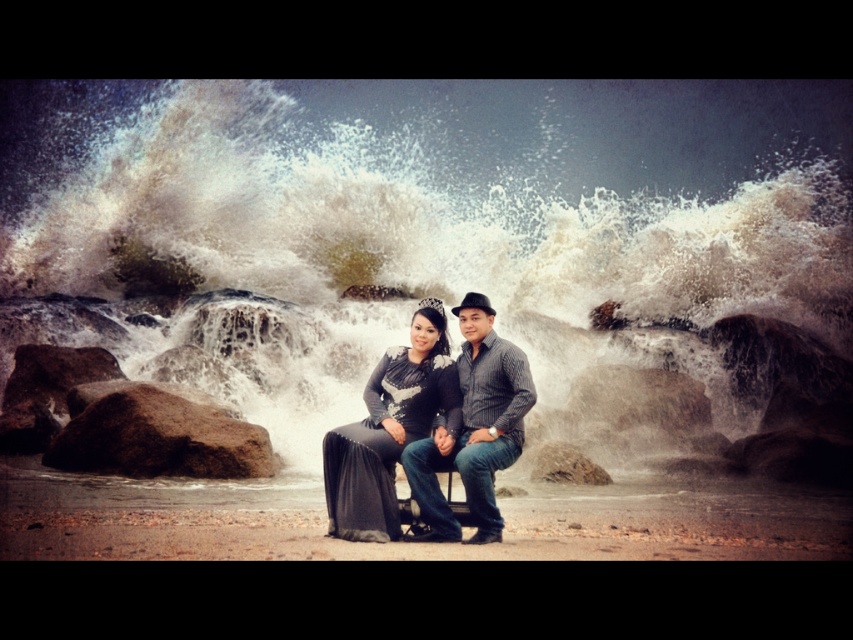
The height and width of the screenshot is (640, 853). Identify the location of white textured water at center. (437, 211).

Who is shorter, white textured water at center or brown rock at lower left?

brown rock at lower left is shorter.

Who is more forward, [757,252] or [93,468]?

Point [93,468]

Locate an element on the screen. The width and height of the screenshot is (853, 640). white textured water at center is located at coordinates (437, 211).

This screenshot has height=640, width=853. I want to click on white textured water at center, so click(437, 211).

Which is below, white textured water at center or matte black dress at center?

matte black dress at center is lower down.

Between point (189, 161) and point (432, 349), which one is positioned in front?

Point (432, 349) is in front.

Image resolution: width=853 pixels, height=640 pixels. Identify the location of white textured water at center. (437, 211).

Is matte black dress at center thinner than brown rock at lower left?

Yes, matte black dress at center is thinner than brown rock at lower left.

Who is higher up, matte black dress at center or brown rock at lower left?

Positioned higher is matte black dress at center.

Image resolution: width=853 pixels, height=640 pixels. I want to click on matte black dress at center, so point(393,429).

Where is `matte black dress at center`? This screenshot has width=853, height=640. matte black dress at center is located at coordinates (393, 429).